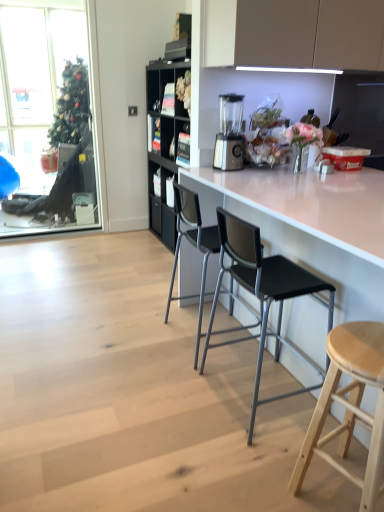
Question: From a real-world perspective, does light wood stool at lower right stand above satin silver blender at center?

Choices:
 (A) no
 (B) yes

Answer: (A)

Question: Considering the relative sizes of light wood stool at lower right and satin silver blender at center in the image provided, is light wood stool at lower right bigger than satin silver blender at center?

Choices:
 (A) yes
 (B) no

Answer: (A)

Question: From the image's perspective, is light wood stool at lower right located above satin silver blender at center?

Choices:
 (A) no
 (B) yes

Answer: (A)

Question: Is light wood stool at lower right at the right side of satin silver blender at center?

Choices:
 (A) yes
 (B) no

Answer: (A)

Question: Is light wood stool at lower right positioned with its back to satin silver blender at center?

Choices:
 (A) no
 (B) yes

Answer: (A)

Question: In the image, is black plastic chair at center, which is the 2th chair from front to back, positioned in front of or behind clear glass window at upper left?

Choices:
 (A) front
 (B) behind

Answer: (A)

Question: From the image's perspective, is black plastic chair at center, the 1th chair in the back-to-front sequence, located above or below clear glass window at upper left?

Choices:
 (A) below
 (B) above

Answer: (A)

Question: In the image, is black plastic chair at center, the 1th chair in the back-to-front sequence, on the left side or the right side of clear glass window at upper left?

Choices:
 (A) right
 (B) left

Answer: (A)

Question: Considering the positions of black plastic chair at center, which is the 2th chair from front to back, and clear glass window at upper left in the image, is black plastic chair at center, which is the 2th chair from front to back, bigger or smaller than clear glass window at upper left?

Choices:
 (A) small
 (B) big

Answer: (B)

Question: Is black plastic chair at center, the 1th chair in the back-to-front sequence, bigger or smaller than white glossy counter at center?

Choices:
 (A) big
 (B) small

Answer: (B)

Question: From a real-world perspective, relative to white glossy counter at center, is black plastic chair at center, which is the 2th chair from front to back, vertically above or below?

Choices:
 (A) below
 (B) above

Answer: (A)

Question: Looking at their shapes, would you say black plastic chair at center, the 1th chair in the back-to-front sequence, is wider or thinner than white glossy counter at center?

Choices:
 (A) wide
 (B) thin

Answer: (B)

Question: In the image, is black plastic chair at center, the 1th chair in the back-to-front sequence, positioned in front of or behind white glossy counter at center?

Choices:
 (A) behind
 (B) front

Answer: (A)

Question: Would you say light wood stool at lower right is to the left or to the right of satin silver blender at center in the picture?

Choices:
 (A) left
 (B) right

Answer: (B)

Question: From a real-world perspective, is light wood stool at lower right physically located above or below satin silver blender at center?

Choices:
 (A) above
 (B) below

Answer: (B)